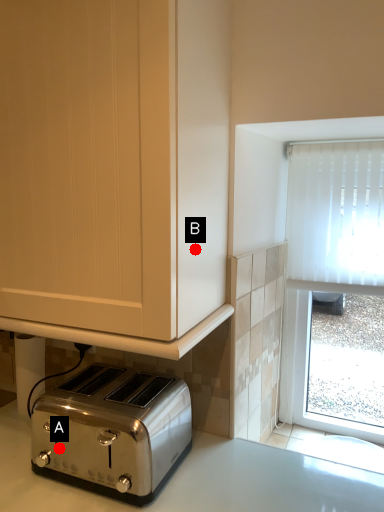
Question: Two points are circled on the image, labeled by A and B beside each circle. Which point is closer to the camera taking this photo?

Choices:
 (A) A is closer
 (B) B is closer

Answer: (B)